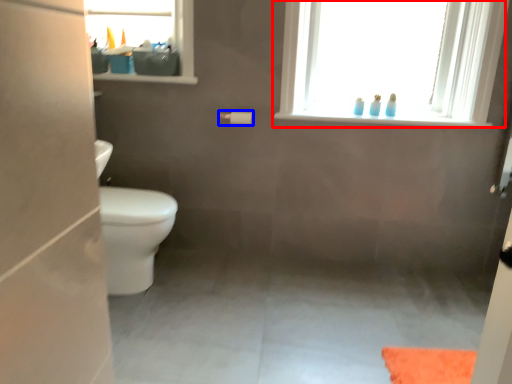
Question: Which of the following is the farthest to the observer, window (highlighted by a red box) or toilet paper (highlighted by a blue box)?

Choices:
 (A) window
 (B) toilet paper

Answer: (B)